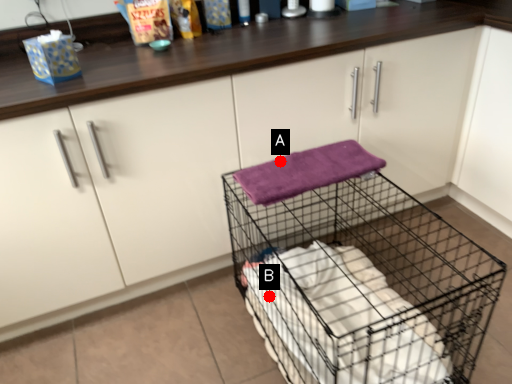
Question: Two points are circled on the image, labeled by A and B beside each circle. Which point is farther from the camera taking this photo?

Choices:
 (A) A is further
 (B) B is further

Answer: (B)